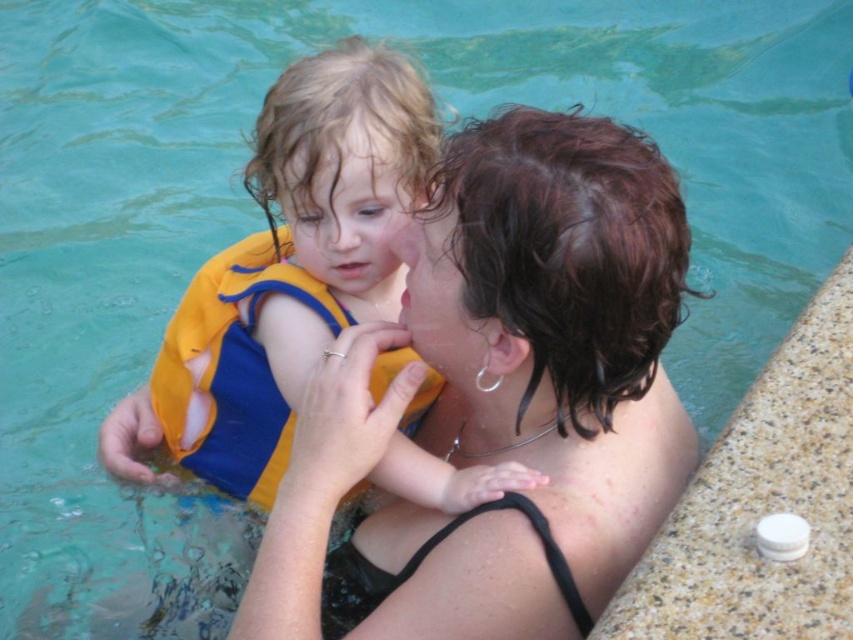
Question: Among these points, which one is farthest from the camera?

Choices:
 (A) (422, 384)
 (B) (398, 112)
 (C) (447, 598)

Answer: (A)

Question: Which of these objects is positioned farthest from the yellow life vest at left?

Choices:
 (A) yellow fabric life jacket at center
 (B) matte yellow life vest at left

Answer: (B)

Question: Is yellow life vest at left positioned before yellow fabric life jacket at center?

Choices:
 (A) yes
 (B) no

Answer: (A)

Question: Is matte yellow life vest at left bigger than yellow life vest at left?

Choices:
 (A) yes
 (B) no

Answer: (A)

Question: Can you confirm if matte yellow life vest at left is positioned to the left of yellow fabric life jacket at center?

Choices:
 (A) no
 (B) yes

Answer: (A)

Question: Which object is positioned closest to the matte yellow life vest at left?

Choices:
 (A) yellow life vest at left
 (B) yellow fabric life jacket at center

Answer: (A)